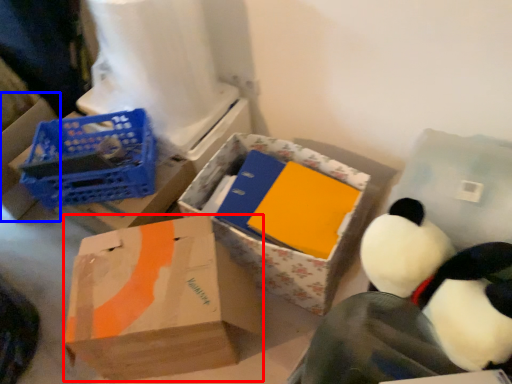
Question: Which of the following is the farthest to the observer, box (highlighted by a red box) or box (highlighted by a blue box)?

Choices:
 (A) box
 (B) box

Answer: (B)